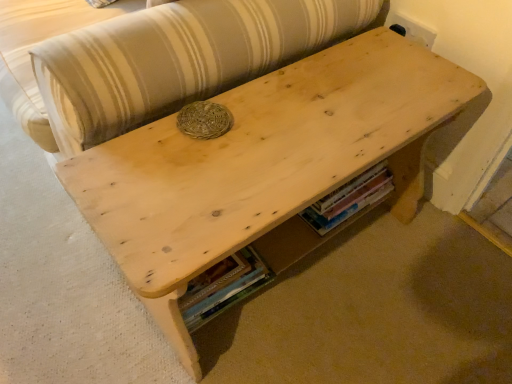
Question: Is wooden book at lower center, which appears as the 1th book when ordered from the bottom, thinner than wooden book at lower center, arranged as the second book when viewed from the left?

Choices:
 (A) yes
 (B) no

Answer: (B)

Question: From a real-world perspective, is wooden book at lower center, arranged as the 2th book when viewed from the top, located higher than wooden book at lower center, the second book in the bottom-to-top sequence?

Choices:
 (A) yes
 (B) no

Answer: (B)

Question: Is wooden book at lower center, the 1th book when ordered from left to right, at the left side of wooden book at lower center, which is counted as the first book, starting from the right?

Choices:
 (A) no
 (B) yes

Answer: (B)

Question: Can you confirm if wooden book at lower center, arranged as the 2th book when viewed from the top, is wider than wooden book at lower center, the second book in the bottom-to-top sequence?

Choices:
 (A) yes
 (B) no

Answer: (A)

Question: Is wooden book at lower center, the 1th book when ordered from left to right, outside wooden book at lower center, the first book when ordered from top to bottom?

Choices:
 (A) yes
 (B) no

Answer: (A)

Question: Is wooden book at lower center, which appears as the 1th book when ordered from the bottom, facing away from wooden book at lower center, the second book in the bottom-to-top sequence?

Choices:
 (A) yes
 (B) no

Answer: (B)

Question: Is wooden book at lower center, arranged as the second book when viewed from the left, bigger than wooden book at lower center, the second book from the right?

Choices:
 (A) yes
 (B) no

Answer: (B)

Question: Considering the relative sizes of wooden book at lower center, which is counted as the first book, starting from the right, and wooden book at lower center, the second book from the right, in the image provided, is wooden book at lower center, which is counted as the first book, starting from the right, shorter than wooden book at lower center, the second book from the right,?

Choices:
 (A) no
 (B) yes

Answer: (B)

Question: From the image's perspective, would you say wooden book at lower center, the first book when ordered from top to bottom, is positioned over wooden book at lower center, the second book from the right?

Choices:
 (A) no
 (B) yes

Answer: (B)

Question: From the image's perspective, is wooden book at lower center, which is counted as the first book, starting from the right, beneath wooden book at lower center, the second book from the right?

Choices:
 (A) no
 (B) yes

Answer: (A)

Question: From a real-world perspective, does wooden book at lower center, which is counted as the first book, starting from the right, sit lower than wooden book at lower center, which appears as the 1th book when ordered from the bottom?

Choices:
 (A) yes
 (B) no

Answer: (B)

Question: Is wooden book at lower center, the second book from the right, inside wooden book at lower center, the second book in the bottom-to-top sequence?

Choices:
 (A) no
 (B) yes

Answer: (A)

Question: Is wooden book at lower center, the second book in the bottom-to-top sequence, closer to the viewer compared to natural wood couch at upper center?

Choices:
 (A) no
 (B) yes

Answer: (A)